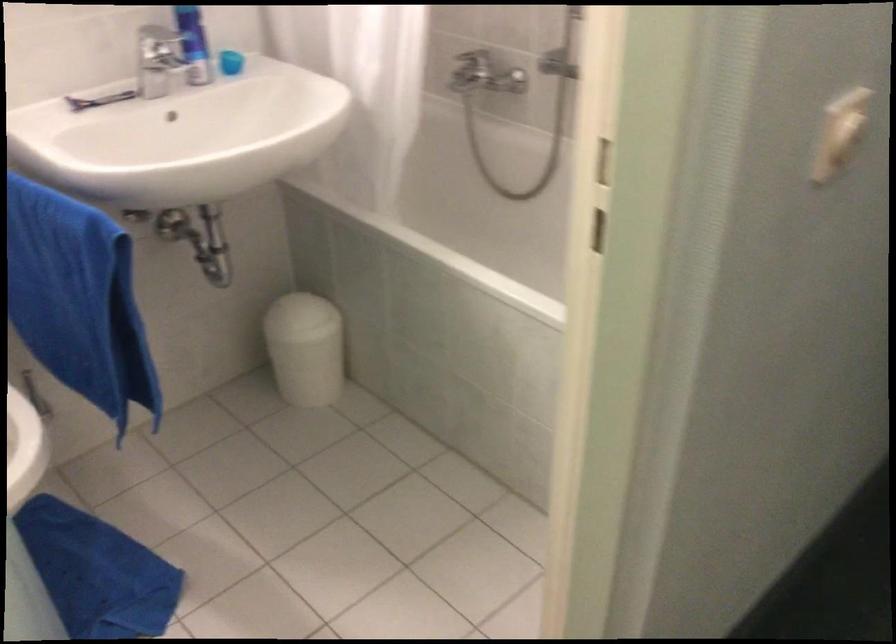
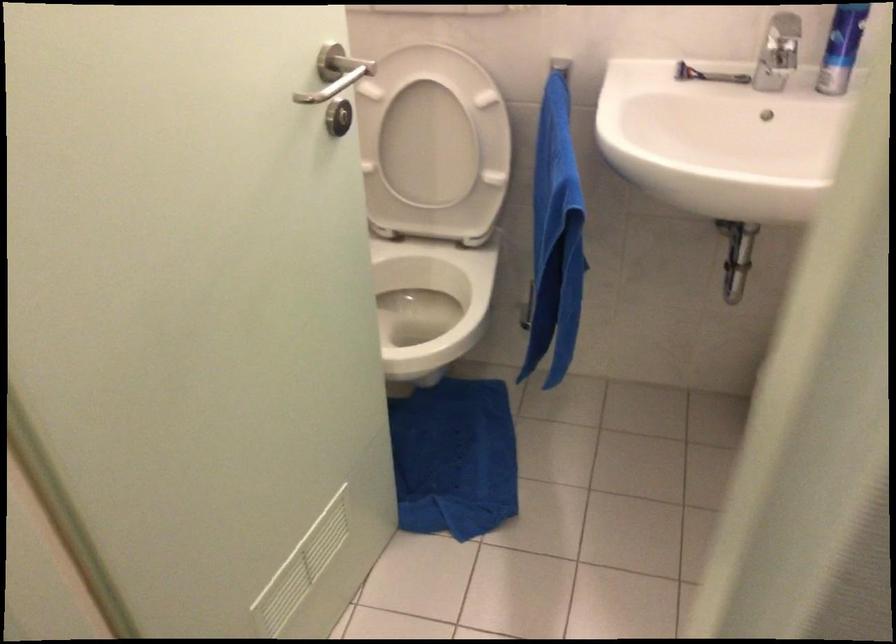
The point at [101,285] is marked in the first image. Where is the corresponding point in the second image?

(555, 238)